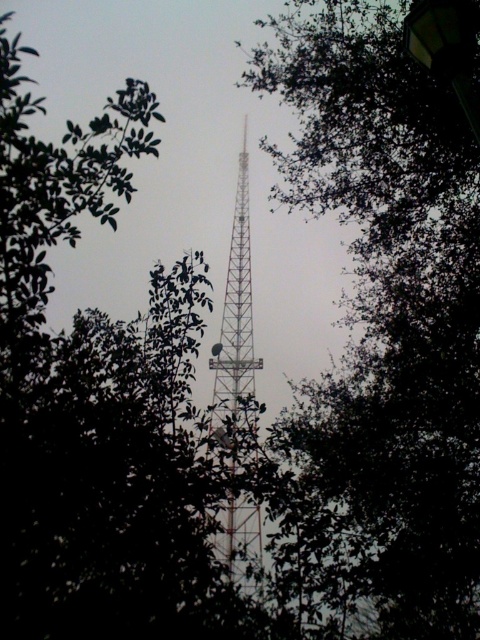
You are a bird flying towards the green leafy tree at center and the metallic lattice tower at center. Which object will you encounter first as you approach from above?

The green leafy tree at center is located below the metallic lattice tower at center, so you will encounter the metallic lattice tower at center first before reaching the green leafy tree at center.

You are a hiker who wants to take a photo of the metallic lattice tower at center without any obstruction. Since you are standing in front of the green leafy tree at center, can you move backward to get a clear view? Explain your reasoning.

The green leafy tree at center is closer to the viewer than the metallic lattice tower at center. If you move backward, the distance between you and the tree increases, but the tree might still block the tower because it is positioned in front. To get an unobstructed view, you might need to move sideways or find a different angle where the tree does not block the tower.

You are standing in front of the communication tower surrounded by trees. You notice two points marked on the tower. The first point is at coordinate point(324, 13) and the second point is at coordinate point(240, 252). Which point is closer to you?

Point(324, 13) is closer to the viewer than point(240, 252).